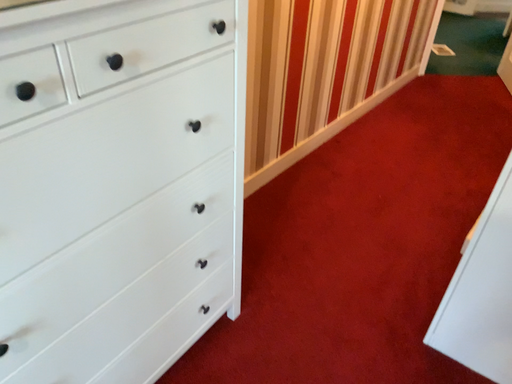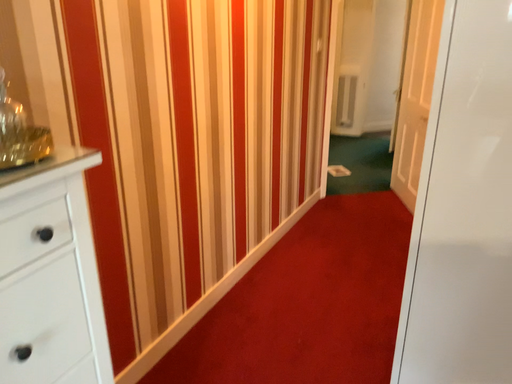
Question: How did the camera likely rotate when shooting the video?

Choices:
 (A) rotated right
 (B) rotated left

Answer: (A)